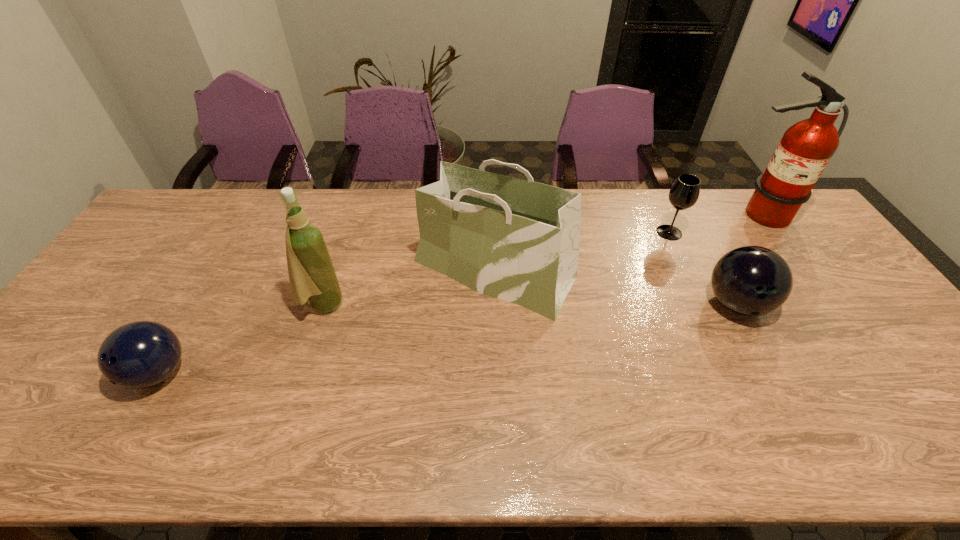
I want to click on vacant area situated on the front-facing side of the wine bottle, so click(478, 305).

Find the location of a particular element. This screenshot has width=960, height=540. vacant space situated on the front of the grocery bag is located at coordinates (498, 421).

Identify the location of vacant area situated 0.320m on the right of the wineglass. This screenshot has width=960, height=540. (780, 233).

This screenshot has height=540, width=960. I want to click on free location located on the side of the taller bowling ball with the finger holes, so click(x=773, y=374).

Image resolution: width=960 pixels, height=540 pixels. I want to click on vacant space located on the surface of the shorter bowling ball near the finger holes, so click(111, 454).

Identify the location of fire extinguisher that is at the far edge. The height and width of the screenshot is (540, 960). (805, 149).

The height and width of the screenshot is (540, 960). Identify the location of grocery bag that is at the far edge. (517, 240).

The height and width of the screenshot is (540, 960). In order to click on wineglass that is at the far edge in this screenshot , I will do `click(684, 193)`.

Where is `object at the right edge`? Image resolution: width=960 pixels, height=540 pixels. object at the right edge is located at coordinates (805, 149).

Find the location of `object that is at the far right corner`. object that is at the far right corner is located at coordinates click(x=805, y=149).